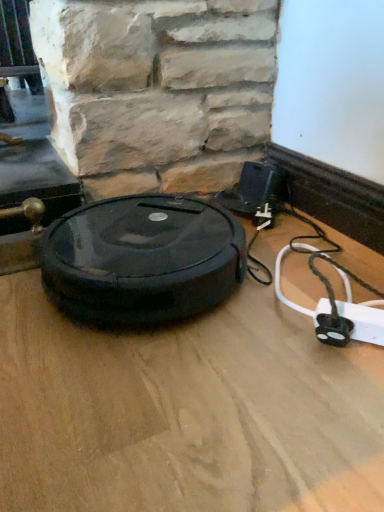
At what (x,y) coordinates should I click in order to perform the action: click on vacant area that is situated to the right of black rubber robot vacuum cleaner at center. Please return your answer as a coordinate pair (x, y). The width and height of the screenshot is (384, 512). Looking at the image, I should click on (301, 274).